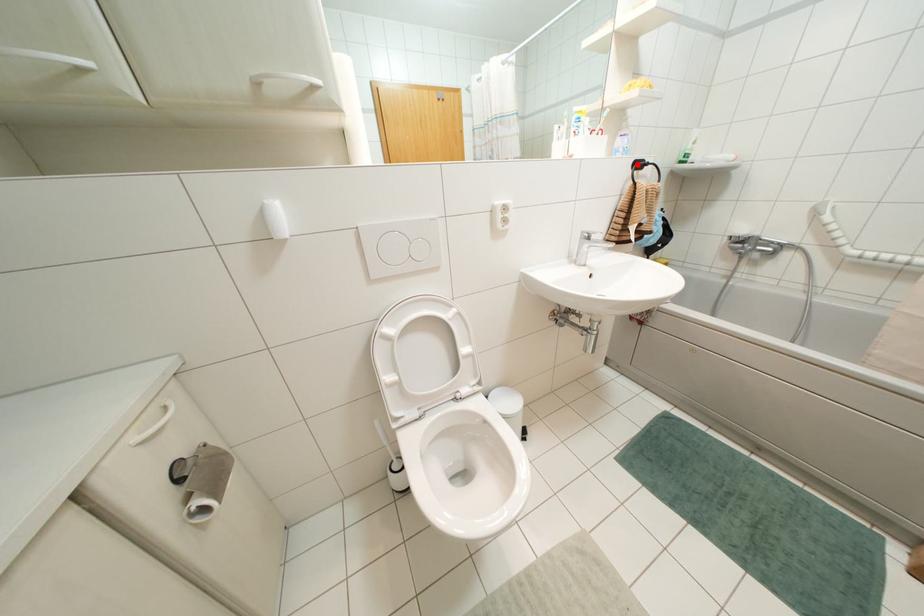
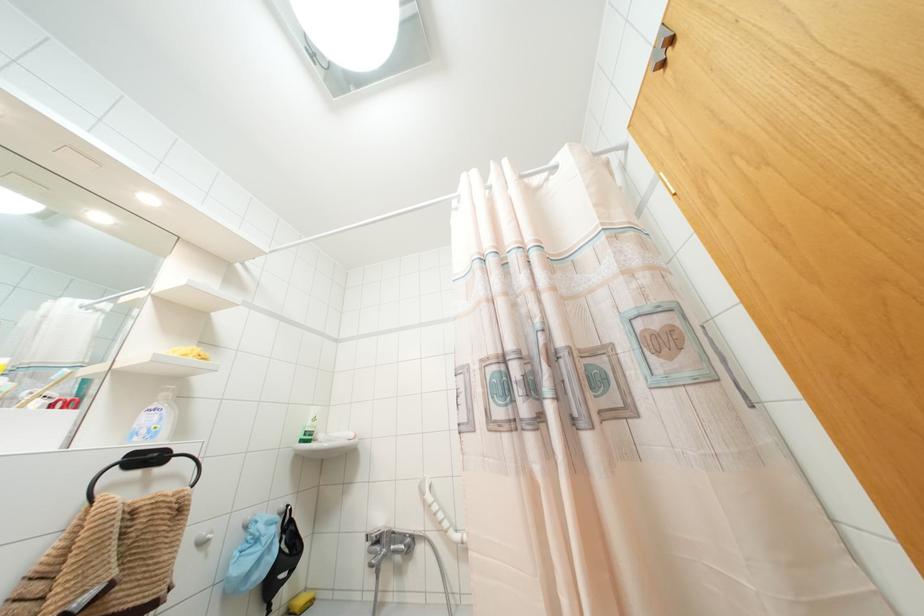
Locate, in the second image, the point that corresponds to the highlighted location in the first image.

(147, 458)